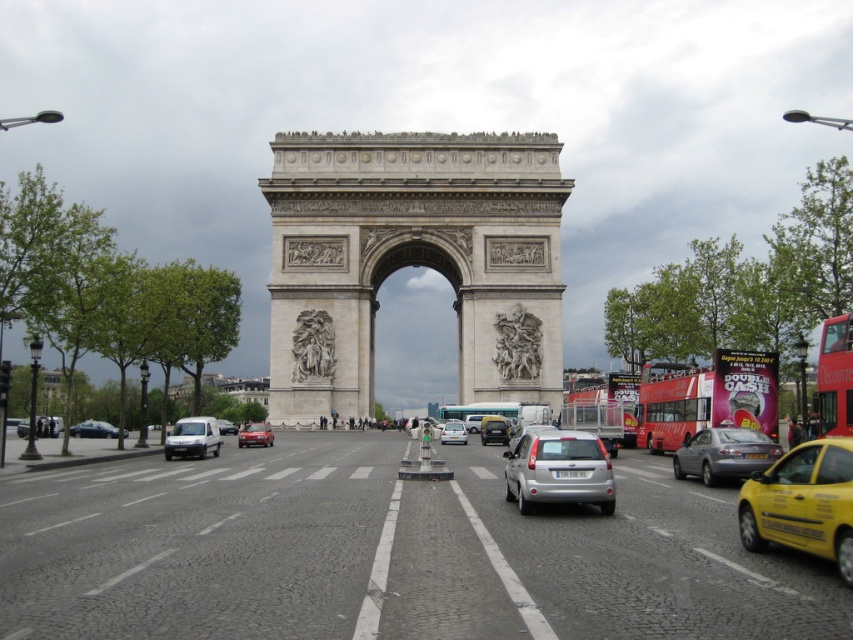
You are standing in the middle of the road in front of the Arc de Triomphe. There is a point marked at coordinates (517, 344). What is located at this point?

The point at coordinates (517, 344) corresponds to the polished stone relief at center.

You are a tourist standing on the sidewalk near the matte black sedan at left and want to take a photo of the white stone sculpture at center. Which direction should you walk to get a clear view of the sculpture without the sedan blocking your shot?

You should walk to the right side of the matte black sedan at left because the white stone sculpture at center is positioned on the right side of the matte black sedan at left, so moving right will provide an unobstructed view.

You are a tour guide leading a group to the Arc de Triomphe. You notice a white stone sculpture at center and a matte black sedan at left. Which object is wider? Please explain your reasoning based on the scene.

The white stone sculpture at center is narrower than the matte black sedan at left because the sculpture has a smaller width compared to the sedan.